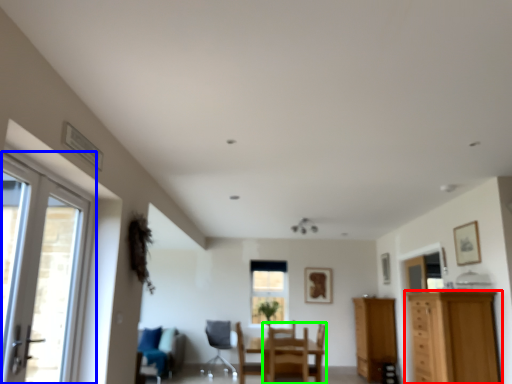
Question: Estimate the real-world distances between objects in this image. Which object is closer to cabinetry (highlighted by a red box), door (highlighted by a blue box) or chair (highlighted by a green box)?

Choices:
 (A) door
 (B) chair

Answer: (B)